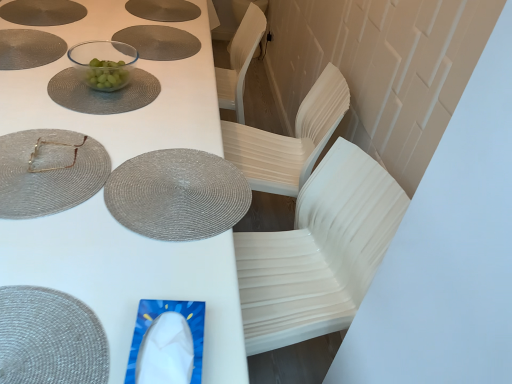
Where is `vacant area that lies between clear glass bowl at upper center, which appears as the fourth tableware when viewed from the front, and gold metallic square at upper left, the 2th tableware when ordered from back to front`? This screenshot has height=384, width=512. vacant area that lies between clear glass bowl at upper center, which appears as the fourth tableware when viewed from the front, and gold metallic square at upper left, the 2th tableware when ordered from back to front is located at coordinates (81, 109).